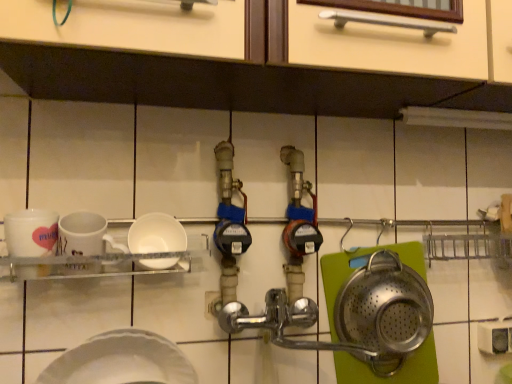
Question: Is white matte bowl at center, the first plate when ordered from top to bottom, located outside white matte plate at lower left, the 1th plate in the bottom-to-top sequence?

Choices:
 (A) yes
 (B) no

Answer: (A)

Question: Does white matte bowl at center, the first plate when ordered from top to bottom, have a lesser height compared to white matte plate at lower left, the second plate in the top-to-bottom sequence?

Choices:
 (A) yes
 (B) no

Answer: (A)

Question: Does white matte bowl at center, which is the 2th plate from bottom to top, have a greater height compared to white matte plate at lower left, the 1th plate in the bottom-to-top sequence?

Choices:
 (A) no
 (B) yes

Answer: (A)

Question: From a real-world perspective, is white matte bowl at center, which is the 2th plate from bottom to top, positioned over white matte plate at lower left, the 1th plate in the bottom-to-top sequence, based on gravity?

Choices:
 (A) no
 (B) yes

Answer: (B)

Question: Can you confirm if white matte bowl at center, which is the 2th plate from bottom to top, is positioned to the left of white matte plate at lower left, the 1th plate in the bottom-to-top sequence?

Choices:
 (A) no
 (B) yes

Answer: (A)

Question: Is white matte bowl at center, which is the 2th plate from bottom to top, far from white matte plate at lower left, the 1th plate in the bottom-to-top sequence?

Choices:
 (A) yes
 (B) no

Answer: (B)

Question: Can you confirm if white glossy mug at left is thinner than white matte plate at lower left, the second plate in the top-to-bottom sequence?

Choices:
 (A) no
 (B) yes

Answer: (B)

Question: Is the depth of white glossy mug at left greater than that of white matte plate at lower left, the 1th plate in the bottom-to-top sequence?

Choices:
 (A) no
 (B) yes

Answer: (B)

Question: Considering the relative sizes of white glossy mug at left and white matte plate at lower left, the 1th plate in the bottom-to-top sequence, in the image provided, is white glossy mug at left taller than white matte plate at lower left, the 1th plate in the bottom-to-top sequence,?

Choices:
 (A) no
 (B) yes

Answer: (B)

Question: Is white glossy mug at left in contact with white matte plate at lower left, the 1th plate in the bottom-to-top sequence?

Choices:
 (A) no
 (B) yes

Answer: (A)

Question: Is the position of white glossy mug at left less distant than that of white matte plate at lower left, the 1th plate in the bottom-to-top sequence?

Choices:
 (A) yes
 (B) no

Answer: (B)

Question: Is white glossy mug at left shorter than white matte plate at lower left, the second plate in the top-to-bottom sequence?

Choices:
 (A) no
 (B) yes

Answer: (A)

Question: Does white glossy mug at left come behind white matte bowl at center, which is the 2th plate from bottom to top?

Choices:
 (A) no
 (B) yes

Answer: (A)